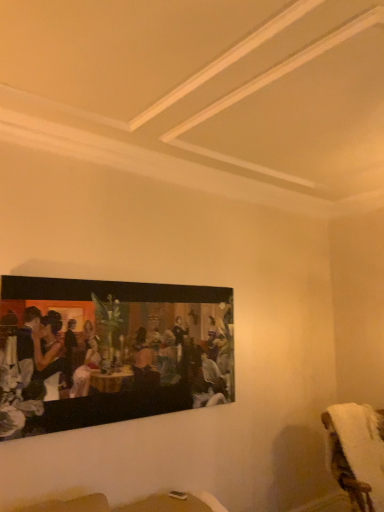
Question: Does matte black painting at upper left turn towards white fluffy towel at lower right?

Choices:
 (A) yes
 (B) no

Answer: (B)

Question: Is matte black painting at upper left far away from white fluffy towel at lower right?

Choices:
 (A) yes
 (B) no

Answer: (A)

Question: Can you confirm if matte black painting at upper left is bigger than white fluffy towel at lower right?

Choices:
 (A) no
 (B) yes

Answer: (A)

Question: Is matte black painting at upper left at the left side of white fluffy towel at lower right?

Choices:
 (A) yes
 (B) no

Answer: (A)

Question: Is white fluffy towel at lower right surrounded by matte black painting at upper left?

Choices:
 (A) no
 (B) yes

Answer: (A)

Question: Does matte black painting at upper left have a smaller size compared to white fluffy towel at lower right?

Choices:
 (A) no
 (B) yes

Answer: (B)

Question: Considering the relative positions of white fluffy towel at lower right and matte black painting at upper left in the image provided, is white fluffy towel at lower right to the right of matte black painting at upper left from the viewer's perspective?

Choices:
 (A) yes
 (B) no

Answer: (A)

Question: Can you confirm if white fluffy towel at lower right is thinner than matte black painting at upper left?

Choices:
 (A) yes
 (B) no

Answer: (B)

Question: Does white fluffy towel at lower right come behind matte black painting at upper left?

Choices:
 (A) yes
 (B) no

Answer: (A)

Question: From a real-world perspective, is white fluffy towel at lower right beneath matte black painting at upper left?

Choices:
 (A) no
 (B) yes

Answer: (B)

Question: Can you confirm if white fluffy towel at lower right is smaller than matte black painting at upper left?

Choices:
 (A) yes
 (B) no

Answer: (B)

Question: Is matte black painting at upper left completely or partially inside white fluffy towel at lower right?

Choices:
 (A) yes
 (B) no

Answer: (B)

Question: Is point (355, 509) positioned closer to the camera than point (24, 304)?

Choices:
 (A) closer
 (B) farther

Answer: (B)